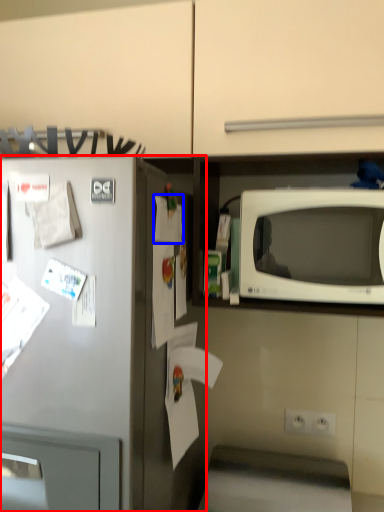
Question: Which point is closer to the camera, refrigerator (highlighted by a red box) or paper (highlighted by a blue box)?

Choices:
 (A) refrigerator
 (B) paper

Answer: (A)